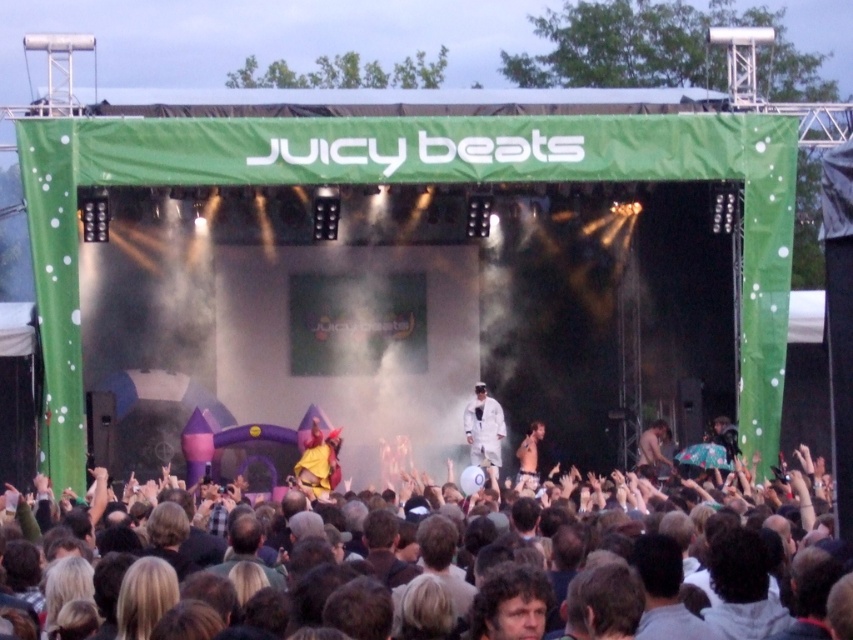
Who is more distant from viewer, (x=477, y=426) or (x=666, y=422)?

Point (x=666, y=422)

Is the position of white matte suit at center more distant than that of dark brown leather jacket at lower right?

That is False.

Who is more forward, (479, 440) or (639, 436)?

Positioned in front is point (479, 440).

This screenshot has width=853, height=640. Find the location of `white matte suit at center`. white matte suit at center is located at coordinates (485, 432).

Can you confirm if yellow fabric at center is taller than dark brown leather jacket at lower right?

No, yellow fabric at center is not taller than dark brown leather jacket at lower right.

Who is higher up, yellow fabric at center or dark brown leather jacket at lower right?

Positioned higher is yellow fabric at center.

Locate an element on the screen. Image resolution: width=853 pixels, height=640 pixels. yellow fabric at center is located at coordinates (318, 461).

Is dark brown leather jacket at lower right positioned at the back of white cotton shirt at center?

Yes, dark brown leather jacket at lower right is behind white cotton shirt at center.

Can you confirm if dark brown leather jacket at lower right is positioned to the left of white cotton shirt at center?

Incorrect, dark brown leather jacket at lower right is not on the left side of white cotton shirt at center.

What are the coordinates of `dark brown leather jacket at lower right` in the screenshot? It's located at (654, 449).

The height and width of the screenshot is (640, 853). I want to click on dark brown leather jacket at lower right, so click(x=654, y=449).